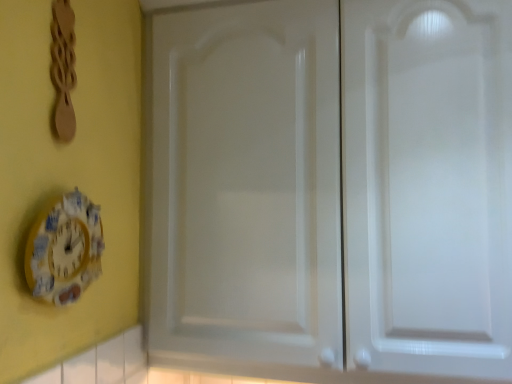
What do you see at coordinates (333, 189) in the screenshot? I see `white glossy cabinet doors at center` at bounding box center [333, 189].

Where is `white glossy cabinet doors at center`? This screenshot has width=512, height=384. white glossy cabinet doors at center is located at coordinates (333, 189).

Is yellow painted wood clock at lower left shorter than wooden spoon at upper left?

Correct, yellow painted wood clock at lower left is not as tall as wooden spoon at upper left.

From the image's perspective, between yellow painted wood clock at lower left and wooden spoon at upper left, who is located below?

From the image's view, yellow painted wood clock at lower left is below.

Is yellow painted wood clock at lower left wider or thinner than wooden spoon at upper left?

yellow painted wood clock at lower left is wider than wooden spoon at upper left.

Is yellow painted wood clock at lower left located outside wooden spoon at upper left?

Yes, yellow painted wood clock at lower left is located beyond the bounds of wooden spoon at upper left.

Does wooden spoon at upper left have a smaller size compared to yellow painted wood clock at lower left?

Yes, wooden spoon at upper left is smaller than yellow painted wood clock at lower left.

I want to click on spoon above the yellow painted wood clock at lower left (from the image's perspective), so click(x=63, y=68).

Considering the positions of points (57, 62) and (69, 280), is point (57, 62) farther from camera compared to point (69, 280)?

No, it is not.

Can you confirm if wooden spoon at upper left is smaller than white glossy cabinet doors at center?

Yes.

From a real-world perspective, is wooden spoon at upper left below white glossy cabinet doors at center?

Incorrect, from a real-world perspective, wooden spoon at upper left is higher than white glossy cabinet doors at center.

Which is more to the right, wooden spoon at upper left or white glossy cabinet doors at center?

Positioned to the right is white glossy cabinet doors at center.

Is wooden spoon at upper left positioned with its back to white glossy cabinet doors at center?

No, wooden spoon at upper left's orientation is not away from white glossy cabinet doors at center.

Would you consider yellow painted wood clock at lower left to be distant from white glossy cabinet doors at center?

Actually, yellow painted wood clock at lower left and white glossy cabinet doors at center are a little close together.

Which is correct: yellow painted wood clock at lower left is inside white glossy cabinet doors at center, or outside of it?

yellow painted wood clock at lower left is not enclosed by white glossy cabinet doors at center.

Looking at this image, from a real-world perspective, is yellow painted wood clock at lower left physically located above or below white glossy cabinet doors at center?

In terms of real-world spatial position, yellow painted wood clock at lower left is below white glossy cabinet doors at center.

From a real-world perspective, does white glossy cabinet doors at center sit lower than wooden spoon at upper left?

Indeed, from a real-world perspective, white glossy cabinet doors at center is positioned beneath wooden spoon at upper left.

How different are the orientations of white glossy cabinet doors at center and wooden spoon at upper left in degrees?

The angle between the facing direction of white glossy cabinet doors at center and the facing direction of wooden spoon at upper left is 90.1 degrees.

Considering their positions, is white glossy cabinet doors at center located in front of or behind wooden spoon at upper left?

Clearly, white glossy cabinet doors at center is behind wooden spoon at upper left.

Which is in front, point (390, 43) or point (56, 9)?

Point (56, 9)

From the image's perspective, is white glossy cabinet doors at center located above yellow painted wood clock at lower left?

Yes.

In the scene shown: Based on their positions, is white glossy cabinet doors at center located to the left or right of yellow painted wood clock at lower left?

white glossy cabinet doors at center is positioned on yellow painted wood clock at lower left's right side.

From a real-world perspective, is white glossy cabinet doors at center physically below yellow painted wood clock at lower left?

No, from a real-world perspective, white glossy cabinet doors at center is not beneath yellow painted wood clock at lower left.

In the scene shown: Is white glossy cabinet doors at center far from yellow painted wood clock at lower left?

They are positioned close to each other.

Find the location of a particular element. spoon behind the yellow painted wood clock at lower left is located at coordinates [x=63, y=68].

I want to click on spoon on the left side of yellow painted wood clock at lower left, so click(63, 68).

In the scene shown: Estimate the real-world distances between objects in this image. Which object is closer to white glossy cabinet doors at center, yellow painted wood clock at lower left or wooden spoon at upper left?

yellow painted wood clock at lower left is closer to white glossy cabinet doors at center.

Considering their positions, is wooden spoon at upper left positioned closer to white glossy cabinet doors at center than yellow painted wood clock at lower left?

yellow painted wood clock at lower left.

In the scene shown: Considering their positions, is white glossy cabinet doors at center positioned further to wooden spoon at upper left than yellow painted wood clock at lower left?

Based on the image, white glossy cabinet doors at center appears to be further to wooden spoon at upper left.

Estimate the real-world distances between objects in this image. Which object is closer to yellow painted wood clock at lower left, white glossy cabinet doors at center or wooden spoon at upper left?

wooden spoon at upper left is closer to yellow painted wood clock at lower left.

Considering their positions, is yellow painted wood clock at lower left positioned further to wooden spoon at upper left than white glossy cabinet doors at center?

white glossy cabinet doors at center is further to wooden spoon at upper left.

From the image, which object appears to be nearer to yellow painted wood clock at lower left, wooden spoon at upper left or white glossy cabinet doors at center?

The object closer to yellow painted wood clock at lower left is wooden spoon at upper left.

At what (x,y) coordinates should I click in order to perform the action: click on clock located between wooden spoon at upper left and white glossy cabinet doors at center in the left-right direction. Please return your answer as a coordinate pair (x, y). This screenshot has width=512, height=384. Looking at the image, I should click on (65, 249).